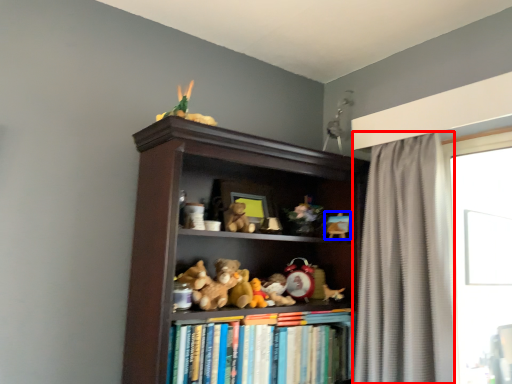
Question: Among these objects, which one is farthest to the camera, curtain (highlighted by a red box) or toy (highlighted by a blue box)?

Choices:
 (A) curtain
 (B) toy

Answer: (B)